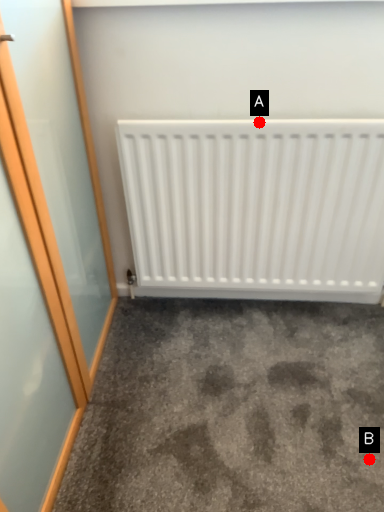
Question: Two points are circled on the image, labeled by A and B beside each circle. Which point is farther from the camera taking this photo?

Choices:
 (A) A is further
 (B) B is further

Answer: (A)